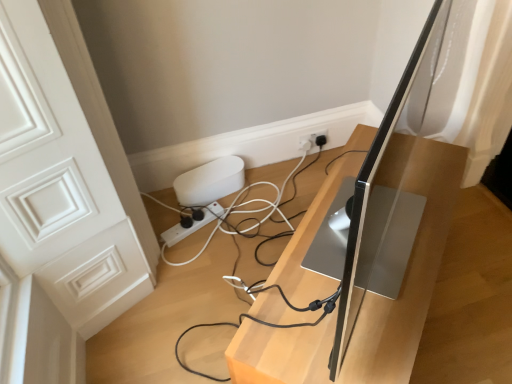
Image resolution: width=512 pixels, height=384 pixels. Identify the location of empty space that is ontop of silver metallic monitor at center (from a real-world perspective). (376, 249).